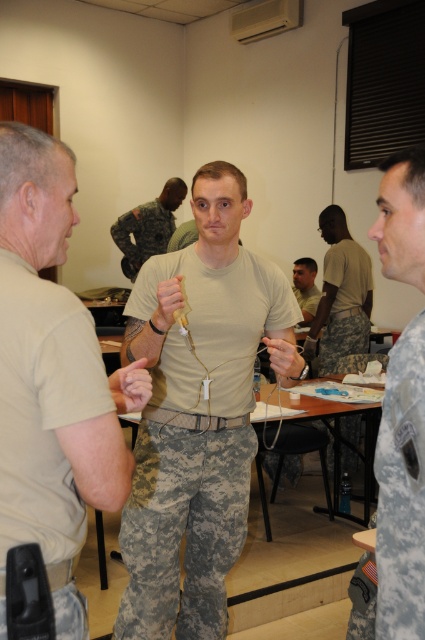
Question: Which point is farther from the camera taking this photo?

Choices:
 (A) (396, 618)
 (B) (334, 307)
 (C) (147, 220)

Answer: (C)

Question: Among these objects, which one is nearest to the camera?

Choices:
 (A) matte khaki shirt at center
 (B) tan matte uniform at center
 (C) tan uniform at center
 (D) tan fabric shirt at center

Answer: (D)

Question: Is tan fabric shirt at center further to the viewer compared to tan uniform at center?

Choices:
 (A) no
 (B) yes

Answer: (A)

Question: Estimate the real-world distances between objects in this image. Which object is farther from the tan uniform at center?

Choices:
 (A) camouflage uniform at center
 (B) tan matte uniform at center
 (C) camouflage fabric uniform at center
 (D) tan fabric shirt at center

Answer: (C)

Question: Does tan uniform at center have a greater width compared to matte khaki shirt at center?

Choices:
 (A) yes
 (B) no

Answer: (A)

Question: Is tan matte uniform at center behind camouflage uniform at center?

Choices:
 (A) yes
 (B) no

Answer: (B)